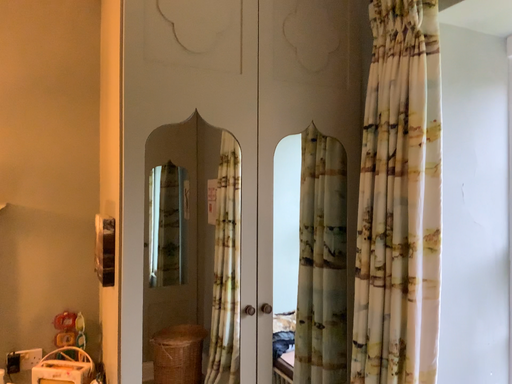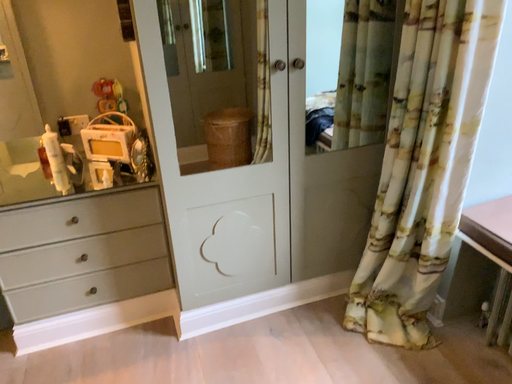
Question: Which way did the camera rotate in the video?

Choices:
 (A) rotated downward
 (B) rotated upward

Answer: (A)